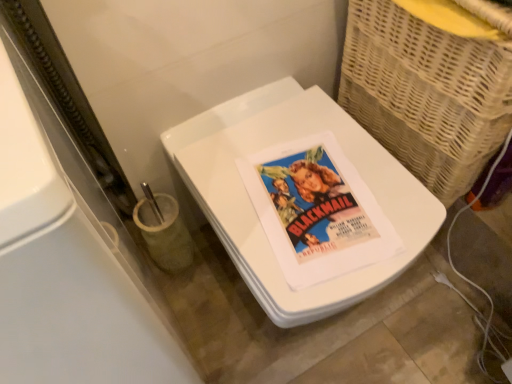
This screenshot has height=384, width=512. What are the coordinates of `vacant area situated below matte paper poster at center (from a real-world perspective)` in the screenshot? It's located at (317, 202).